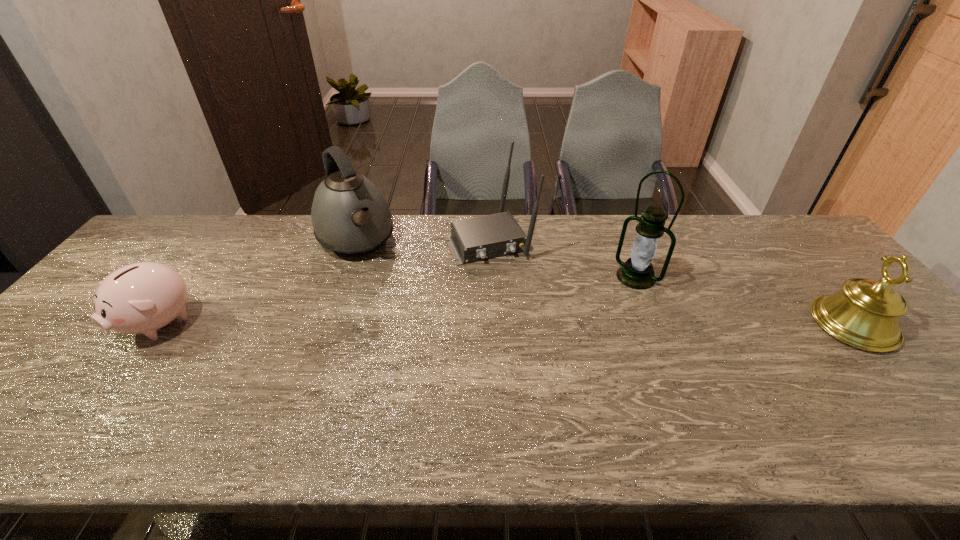
In order to click on object that is at the left edge in this screenshot , I will do `click(140, 298)`.

Locate an element on the screen. The height and width of the screenshot is (540, 960). object at the right edge is located at coordinates (865, 314).

This screenshot has height=540, width=960. In the image, there is a desktop. Find the location of `free space at the far edge`. free space at the far edge is located at coordinates (253, 251).

At what (x,y) coordinates should I click in order to perform the action: click on vacant position at the near edge of the desktop. Please return your answer as a coordinate pair (x, y). This screenshot has height=540, width=960. Looking at the image, I should click on (788, 397).

In the image, there is a desktop. Identify the location of vacant space at the far left corner. This screenshot has height=540, width=960. (160, 251).

Where is `free space at the far right corner`? This screenshot has height=540, width=960. free space at the far right corner is located at coordinates (790, 229).

I want to click on empty location between the second shortest object and the fourth object from left to right, so click(x=745, y=301).

Locate an element on the screen. free area in between the router and the kettle is located at coordinates (422, 241).

You are a GUI agent. You are given a task and a screenshot of the screen. Output one action in this format:
    pyautogui.click(x=<x>, y=<y>)
    Task: Click on the vacant region between the bell and the third object from left to right
    
    Given the screenshot: What is the action you would take?
    pyautogui.click(x=671, y=283)

Locate an element on the screen. unoccupied position between the third object from right to left and the second object from left to right is located at coordinates [422, 241].